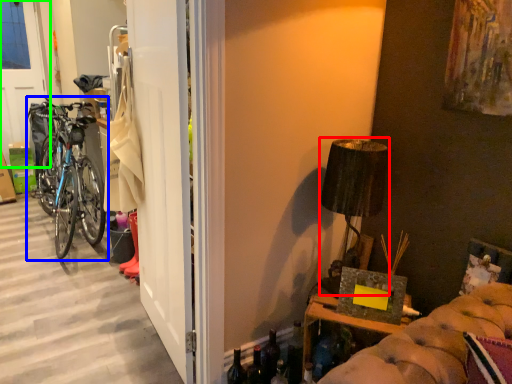
Question: Which object is positioned closest to lamp (highlighted by a red box)? Select from bicycle (highlighted by a blue box) and screen door (highlighted by a green box).

Choices:
 (A) bicycle
 (B) screen door

Answer: (A)